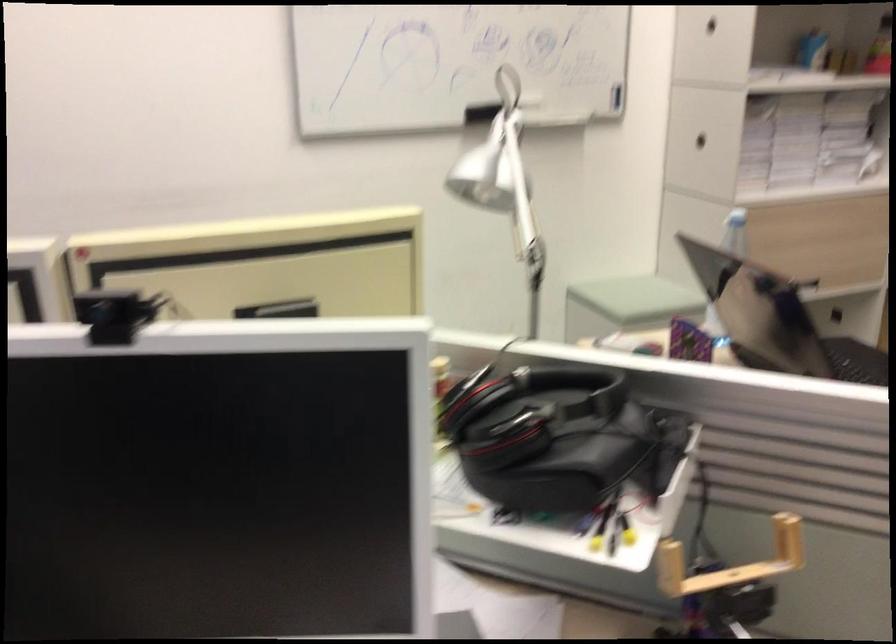
Where is `water bottle`? Image resolution: width=896 pixels, height=644 pixels. water bottle is located at coordinates (735, 232).